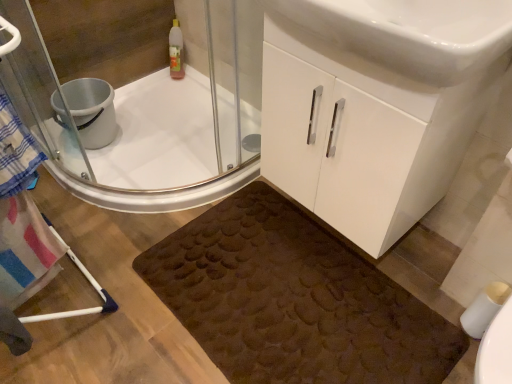
This screenshot has width=512, height=384. What are the coordinates of `free space above silver metallic bucket at upper left (from a real-world perspective)` in the screenshot? It's located at (73, 91).